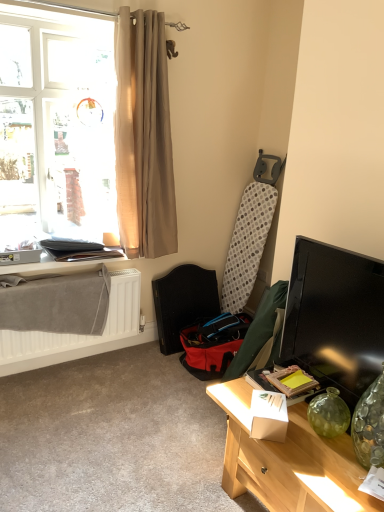
Question: Is red fabric folding chair at center surrounding white matte radiator at lower left?

Choices:
 (A) yes
 (B) no

Answer: (B)

Question: Considering the relative positions of red fabric folding chair at center and white matte radiator at lower left in the image provided, is red fabric folding chair at center in front of white matte radiator at lower left?

Choices:
 (A) yes
 (B) no

Answer: (B)

Question: Is red fabric folding chair at center at the right side of white matte radiator at lower left?

Choices:
 (A) yes
 (B) no

Answer: (A)

Question: Is red fabric folding chair at center bigger than white matte radiator at lower left?

Choices:
 (A) no
 (B) yes

Answer: (B)

Question: Does red fabric folding chair at center come behind white matte radiator at lower left?

Choices:
 (A) no
 (B) yes

Answer: (B)

Question: Considering the relative sizes of red fabric folding chair at center and white matte radiator at lower left in the image provided, is red fabric folding chair at center shorter than white matte radiator at lower left?

Choices:
 (A) yes
 (B) no

Answer: (B)

Question: Are light wood desk at lower right and matte black table at lower left making contact?

Choices:
 (A) no
 (B) yes

Answer: (A)

Question: From a real-world perspective, is light wood desk at lower right positioned over matte black table at lower left based on gravity?

Choices:
 (A) no
 (B) yes

Answer: (A)

Question: Is light wood desk at lower right completely or partially outside of matte black table at lower left?

Choices:
 (A) no
 (B) yes

Answer: (B)

Question: Does light wood desk at lower right have a larger size compared to matte black table at lower left?

Choices:
 (A) no
 (B) yes

Answer: (B)

Question: Can you confirm if light wood desk at lower right is taller than matte black table at lower left?

Choices:
 (A) yes
 (B) no

Answer: (A)

Question: Can you confirm if light wood desk at lower right is positioned to the right of matte black table at lower left?

Choices:
 (A) yes
 (B) no

Answer: (A)

Question: Is matte black table at lower left not close to beige fabric curtain at upper left?

Choices:
 (A) yes
 (B) no

Answer: (B)